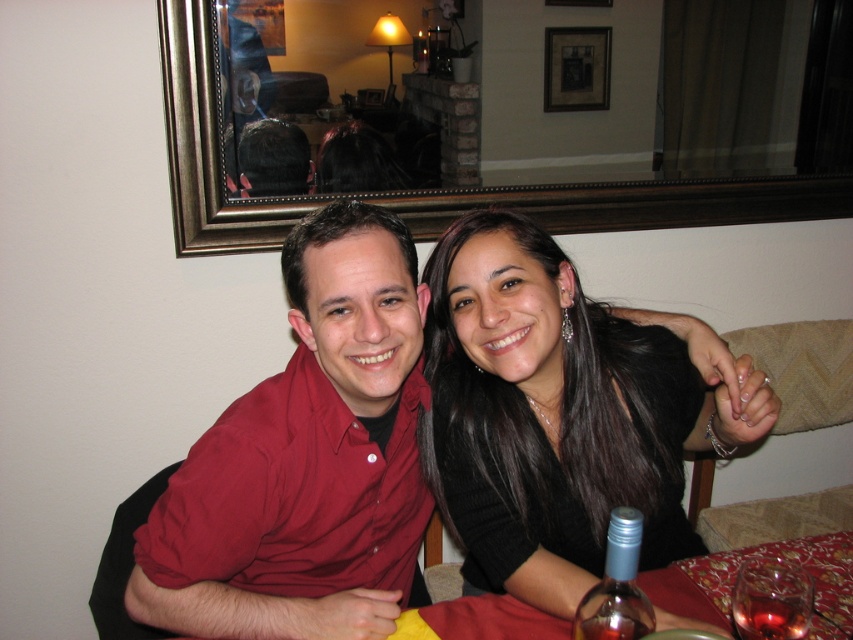
Question: Which point appears farthest from the camera in this image?

Choices:
 (A) (561, 627)
 (B) (796, 600)
 (C) (354, 604)

Answer: (C)

Question: Is black matte hair at center thinner than silky red tablecloth at lower center?

Choices:
 (A) yes
 (B) no

Answer: (A)

Question: Is clear glass bottle at lower right closer to the viewer compared to transparent glass at lower right?

Choices:
 (A) yes
 (B) no

Answer: (A)

Question: Which of these objects is positioned closest to the silky red tablecloth at lower center?

Choices:
 (A) translucent glass wine at lower right
 (B) wooden picture frame at upper center
 (C) black matte hair at center
 (D) clear glass bottle at lower right

Answer: (D)

Question: Does clear glass bottle at lower right have a lesser width compared to wooden picture frame at upper center?

Choices:
 (A) yes
 (B) no

Answer: (A)

Question: Among these objects, which one is nearest to the camera?

Choices:
 (A) black matte hair at center
 (B) translucent glass wine at lower right
 (C) silky red tablecloth at lower center
 (D) wooden picture frame at upper center

Answer: (B)